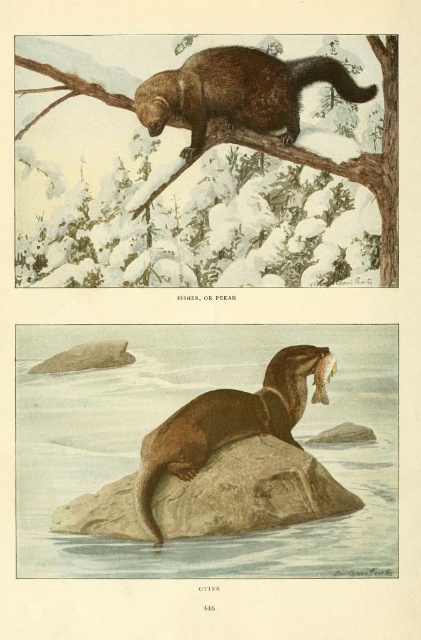
Looking at the top panel of the natural history book, you see a brown furry beaver at upper center and a smooth brown fur at upper center. Which one is positioned higher?

The brown furry beaver at upper center is positioned higher than the smooth brown fur at upper center.

You are standing 3 meters away from the camera. Can you see the point at coordinates point [237,486] in the image?

The point at coordinates point [237,486] is 2.67 meters away from the camera. Since you are standing 3 meters away from the camera, you are farther than the point, so you can see it.